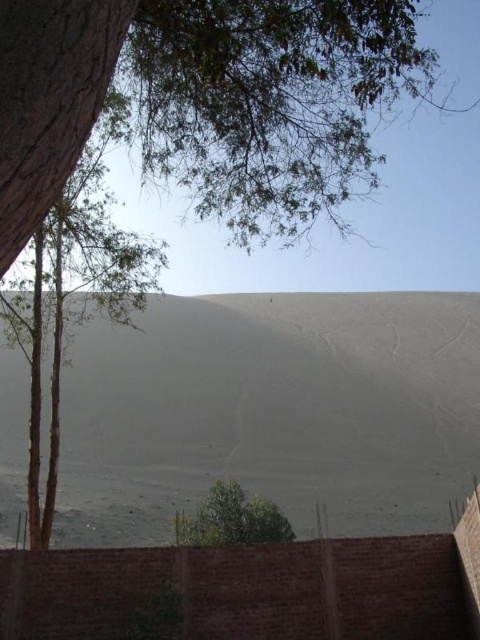
Question: Based on their relative distances, which object is nearer to the green leafy tree at lower center?

Choices:
 (A) green leafy tree at left
 (B) gray sand dune at center

Answer: (A)

Question: Is gray sand dune at center wider than green leafy tree at lower center?

Choices:
 (A) yes
 (B) no

Answer: (A)

Question: Which object is closer to the camera taking this photo?

Choices:
 (A) green leafy tree at lower center
 (B) green leafy tree at left

Answer: (B)

Question: Can you confirm if gray sand dune at center is positioned to the left of green leafy tree at lower center?

Choices:
 (A) yes
 (B) no

Answer: (B)

Question: Which point is farther to the camera?

Choices:
 (A) gray sand dune at center
 (B) green leafy tree at left
 (C) green leafy tree at lower center

Answer: (A)

Question: Does gray sand dune at center have a lesser width compared to green leafy tree at lower center?

Choices:
 (A) no
 (B) yes

Answer: (A)